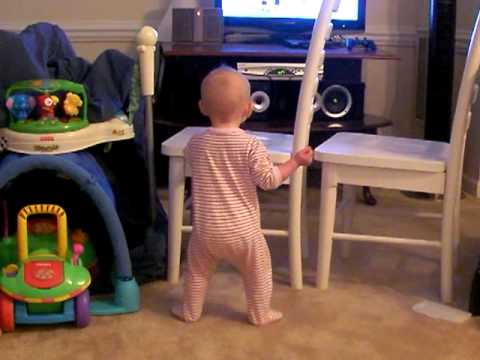
At what (x,y) coordinates should I click in order to perform the action: click on chair. Please return your answer as a coordinate pair (x, y). The height and width of the screenshot is (360, 480). Looking at the image, I should click on (375, 161).